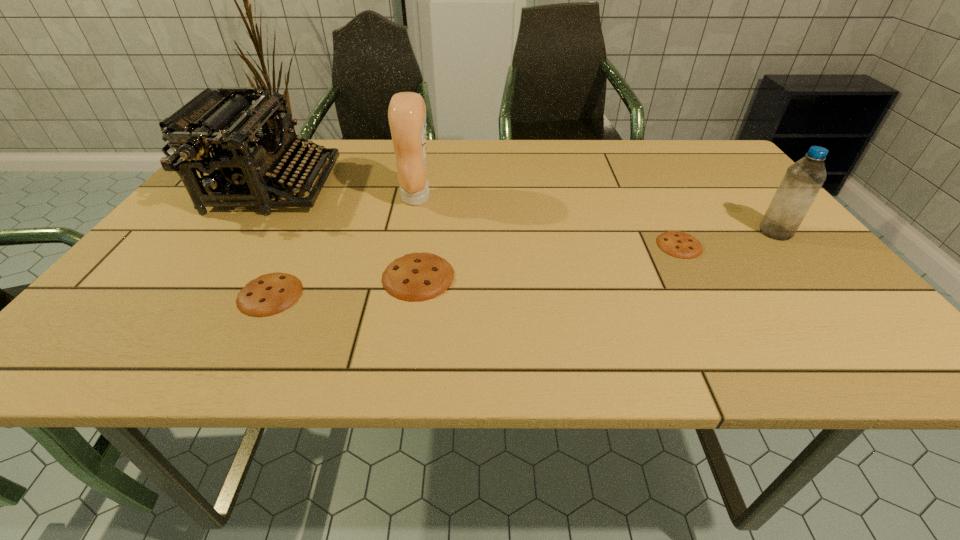
This screenshot has width=960, height=540. I want to click on free space for an extra cookie to achieve even spacing, so click(x=554, y=260).